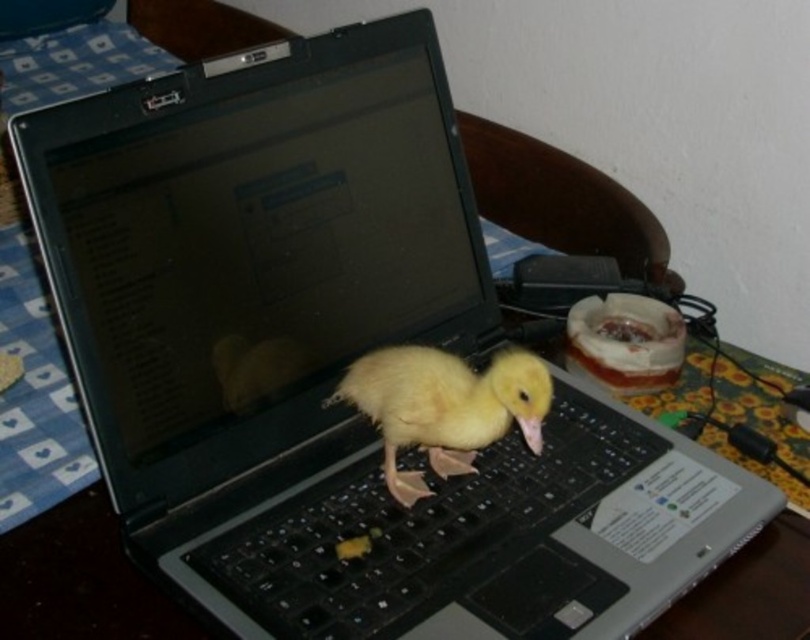
Question: Is black plastic keyboard at center positioned behind yellow downy duckling at center?

Choices:
 (A) no
 (B) yes

Answer: (A)

Question: Is black plastic keyboard at center bigger than yellow downy duckling at center?

Choices:
 (A) yes
 (B) no

Answer: (A)

Question: Can you confirm if black plastic keyboard at center is positioned to the right of yellow downy duckling at center?

Choices:
 (A) no
 (B) yes

Answer: (A)

Question: Among these objects, which one is farthest from the camera?

Choices:
 (A) yellow downy duckling at center
 (B) black plastic keyboard at center

Answer: (A)